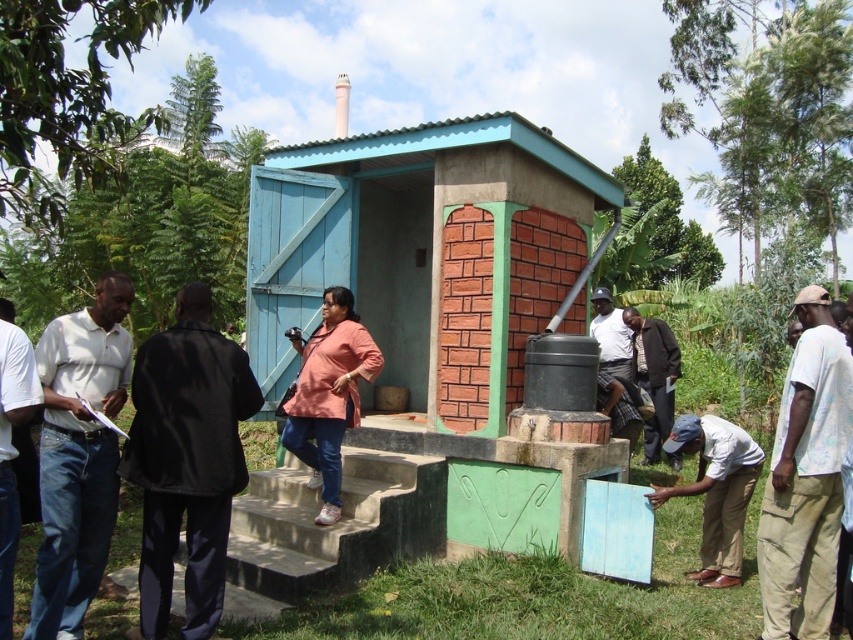
What is located at the coordinates point (445, 307)?

The point (445, 307) marks the blue painted wood at center.

You are a painter who needs to decide which item requires more paint. Based on the scene, which one between the blue painted wood at center and the black fabric jacket at left needs more paint?

The blue painted wood at center needs more paint because it is larger in size than the black fabric jacket at left.

You are standing at the point marked by coordinates point (173,438) and want to take a photo of the restroom structure. If your camera has a maximum focus range of 4 meters, will you be able to capture the restroom clearly?

The distance between point (173,438) and the camera is 3.88 meters, which is within the camera maximum focus range of 4 meters. Therefore, you can capture the restroom clearly.